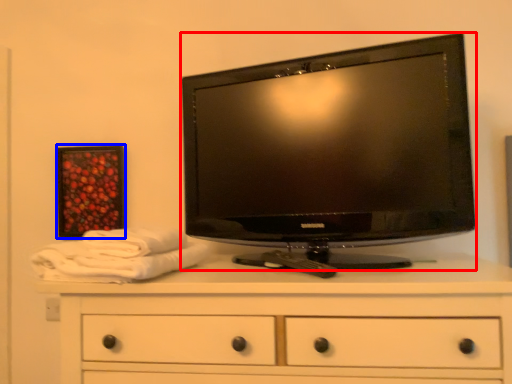
Question: Which object is closer to the camera taking this photo, television (highlighted by a red box) or picture frame (highlighted by a blue box)?

Choices:
 (A) television
 (B) picture frame

Answer: (A)